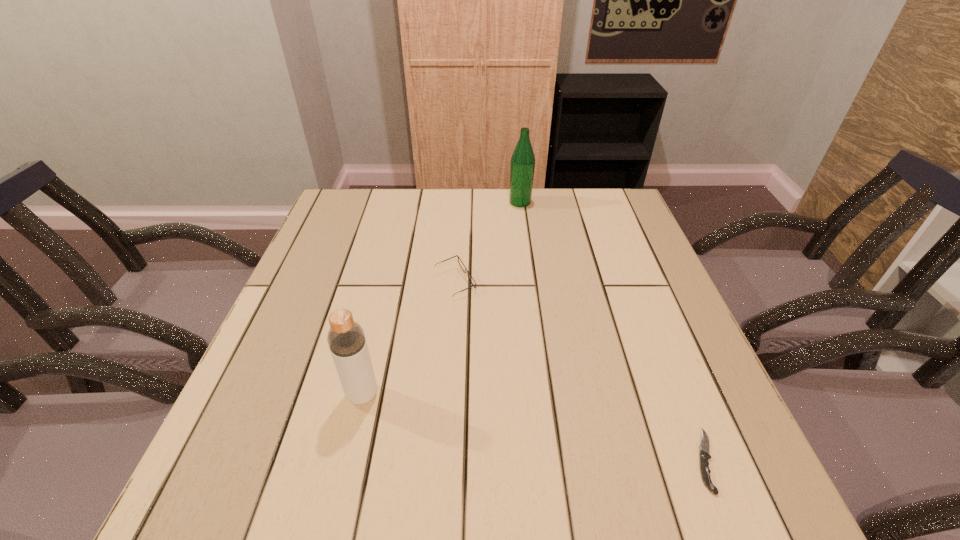
Identify the location of the farthest object. click(x=522, y=165).

Image resolution: width=960 pixels, height=540 pixels. I want to click on the second object from right to left, so click(x=522, y=165).

Locate an element on the screen. the nearer bottle is located at coordinates (346, 339).

Where is `the left bottle`? the left bottle is located at coordinates tap(346, 339).

This screenshot has width=960, height=540. Find the location of `spectacles`. spectacles is located at coordinates (460, 262).

Find the location of a particular element. the third object from right to left is located at coordinates (460, 262).

Where is `pocketknife`? Image resolution: width=960 pixels, height=540 pixels. pocketknife is located at coordinates (704, 447).

You are a GUI agent. You are given a task and a screenshot of the screen. Output one action in this format:
    pyautogui.click(x=<x>, y=<y>)
    Task: Click on the nearest object
    
    Given the screenshot: What is the action you would take?
    pyautogui.click(x=704, y=447)

Image resolution: width=960 pixels, height=540 pixels. In order to click on free region located 0.400m on the front of the farther bottle in this screenshot , I will do [533, 298].

This screenshot has width=960, height=540. Find the location of `free location located on the right of the leftmost object`. free location located on the right of the leftmost object is located at coordinates (533, 395).